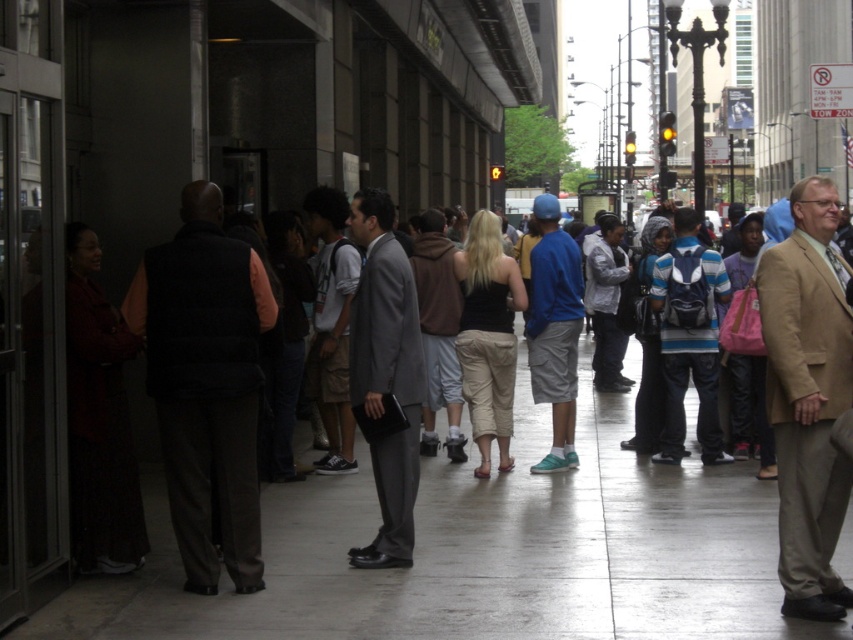
Question: Does striped knit sweater at center have a greater width compared to brown suede hoodie at center?

Choices:
 (A) no
 (B) yes

Answer: (B)

Question: Which of these objects is positioned closest to the striped knit sweater at center?

Choices:
 (A) dark gray vest at left
 (B) brown suede hoodie at center
 (C) blue cotton shirt at center
 (D) concrete sidewalk at center

Answer: (C)

Question: Which point is closer to the camera?

Choices:
 (A) (850, 369)
 (B) (438, 248)
 (C) (556, 614)
 (D) (183, 428)

Answer: (A)

Question: Does blue cotton shirt at center have a larger size compared to brown suede hoodie at center?

Choices:
 (A) no
 (B) yes

Answer: (A)

Question: Which is farther from the dark gray vest at left?

Choices:
 (A) blue cotton shirt at center
 (B) striped knit sweater at center

Answer: (B)

Question: Is tan fabric suit at right above brown suede hoodie at center?

Choices:
 (A) no
 (B) yes

Answer: (A)